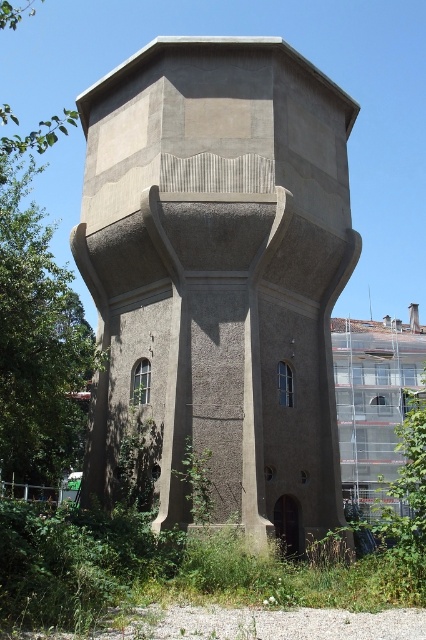
Between concrete textured tower at center and green leafy weed at lower center, which one is positioned lower?

Positioned lower is green leafy weed at lower center.

Can you confirm if concrete textured tower at center is bigger than green leafy weed at lower center?

Yes.

Between point (106, 163) and point (206, 458), which one is positioned behind?

Positioned behind is point (106, 163).

Find the location of a particular element. This screenshot has height=640, width=426. concrete textured tower at center is located at coordinates (219, 275).